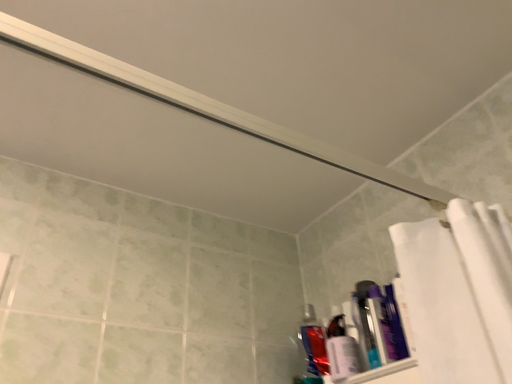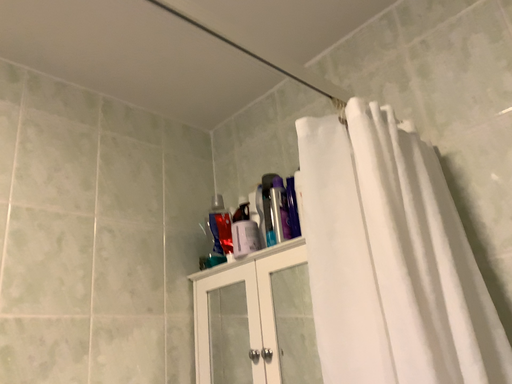
Question: Which way did the camera rotate in the video?

Choices:
 (A) rotated downward
 (B) rotated upward

Answer: (A)